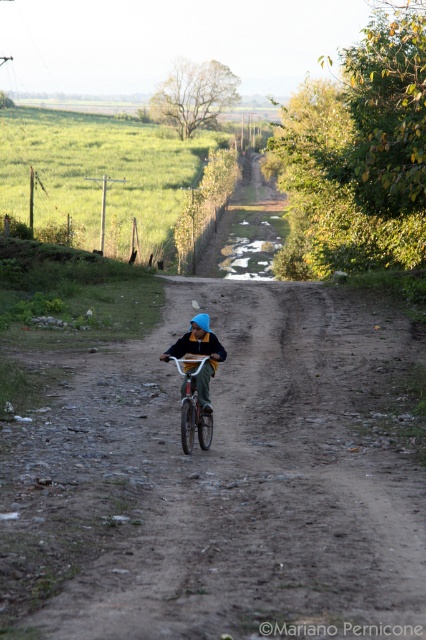
Question: Does blue fabric helmet at center have a smaller size compared to white matte bicycle at center?

Choices:
 (A) no
 (B) yes

Answer: (A)

Question: Among these objects, which one is nearest to the camera?

Choices:
 (A) white matte bicycle at center
 (B) blue fabric helmet at center

Answer: (A)

Question: Does blue fabric helmet at center lie behind white matte bicycle at center?

Choices:
 (A) no
 (B) yes

Answer: (B)

Question: Among these objects, which one is nearest to the camera?

Choices:
 (A) white matte bicycle at center
 (B) blue fabric helmet at center

Answer: (A)

Question: Is blue fabric helmet at center below white matte bicycle at center?

Choices:
 (A) yes
 (B) no

Answer: (B)

Question: Which of the following is the farthest from the observer?

Choices:
 (A) white matte bicycle at center
 (B) blue fabric helmet at center

Answer: (B)